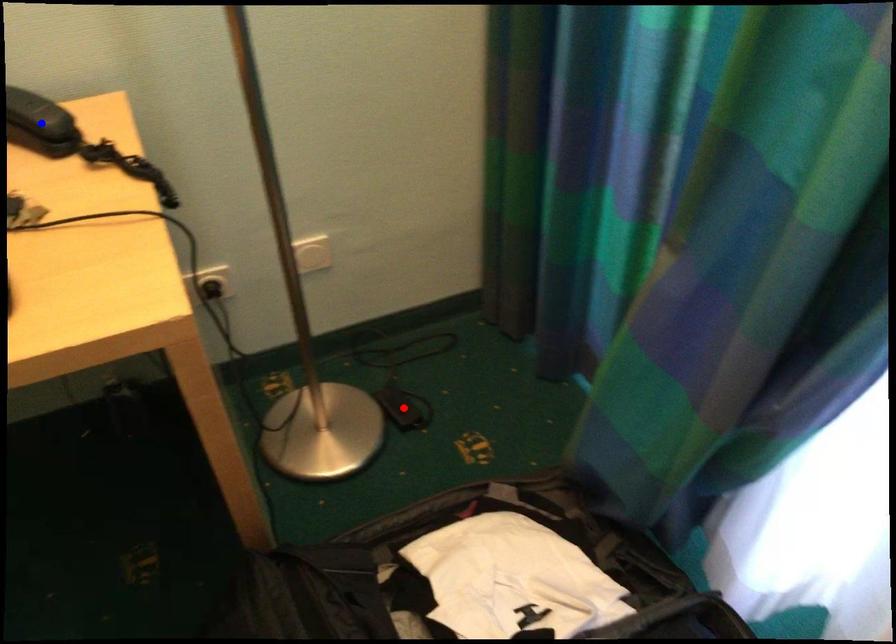
Question: Two points are marked on the image. Which point is closer to the camera?

Choices:
 (A) Blue point is closer.
 (B) Red point is closer.

Answer: (A)